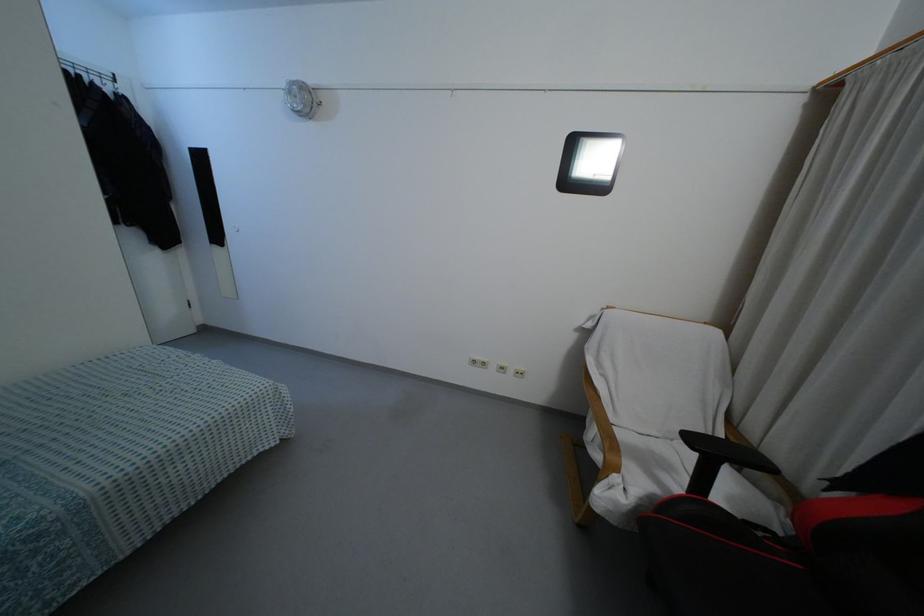
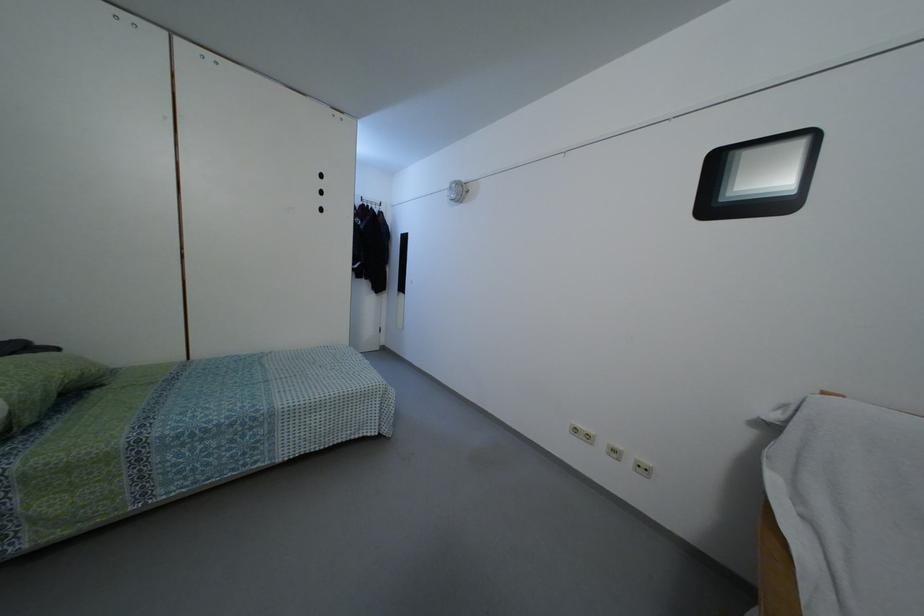
Where in the second image is the point corresponding to pixel 520 368 from the first image?

(646, 461)